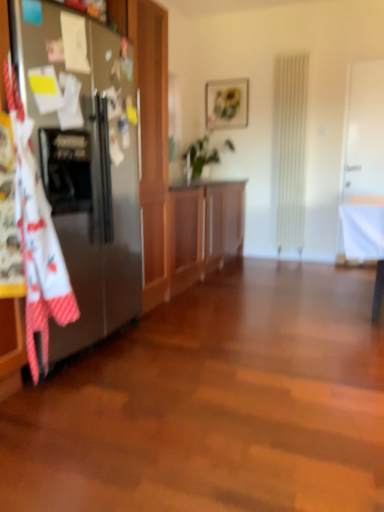
Question: From the image's perspective, is green leafy plant at center on top of matte wooden picture frame at upper center?

Choices:
 (A) no
 (B) yes

Answer: (A)

Question: Is green leafy plant at center at the right side of matte wooden picture frame at upper center?

Choices:
 (A) no
 (B) yes

Answer: (A)

Question: Considering the relative sizes of green leafy plant at center and matte wooden picture frame at upper center in the image provided, is green leafy plant at center wider than matte wooden picture frame at upper center?

Choices:
 (A) yes
 (B) no

Answer: (A)

Question: Is green leafy plant at center touching matte wooden picture frame at upper center?

Choices:
 (A) no
 (B) yes

Answer: (A)

Question: Is green leafy plant at center taller than matte wooden picture frame at upper center?

Choices:
 (A) no
 (B) yes

Answer: (B)

Question: Considering the positions of point (107, 192) and point (240, 97), is point (107, 192) closer or farther from the camera than point (240, 97)?

Choices:
 (A) farther
 (B) closer

Answer: (B)

Question: Considering the positions of satin silver refrigerator at left and matte wooden picture frame at upper center in the image, is satin silver refrigerator at left wider or thinner than matte wooden picture frame at upper center?

Choices:
 (A) wide
 (B) thin

Answer: (A)

Question: From the image's perspective, is satin silver refrigerator at left located above or below matte wooden picture frame at upper center?

Choices:
 (A) below
 (B) above

Answer: (A)

Question: Considering the positions of satin silver refrigerator at left and matte wooden picture frame at upper center in the image, is satin silver refrigerator at left bigger or smaller than matte wooden picture frame at upper center?

Choices:
 (A) small
 (B) big

Answer: (B)

Question: Considering the positions of wooden cabinet at center and satin silver refrigerator at left in the image, is wooden cabinet at center wider or thinner than satin silver refrigerator at left?

Choices:
 (A) wide
 (B) thin

Answer: (A)

Question: Is wooden cabinet at center inside or outside of satin silver refrigerator at left?

Choices:
 (A) outside
 (B) inside

Answer: (A)

Question: In the image, is wooden cabinet at center positioned in front of or behind satin silver refrigerator at left?

Choices:
 (A) front
 (B) behind

Answer: (B)

Question: Is point (203, 237) positioned closer to the camera than point (119, 126)?

Choices:
 (A) farther
 (B) closer

Answer: (A)

Question: Considering the relative positions of matte wooden picture frame at upper center and wooden cabinet at center in the image provided, is matte wooden picture frame at upper center to the left or to the right of wooden cabinet at center?

Choices:
 (A) left
 (B) right

Answer: (B)

Question: Relative to wooden cabinet at center, is matte wooden picture frame at upper center in front or behind?

Choices:
 (A) front
 (B) behind

Answer: (B)